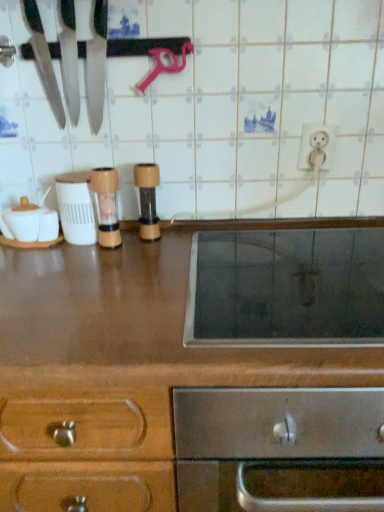
Image resolution: width=384 pixels, height=512 pixels. Identify the location of free spot to the left of wooden pepper grinder at center, the second appliance in the left-to-right sequence. (47, 256).